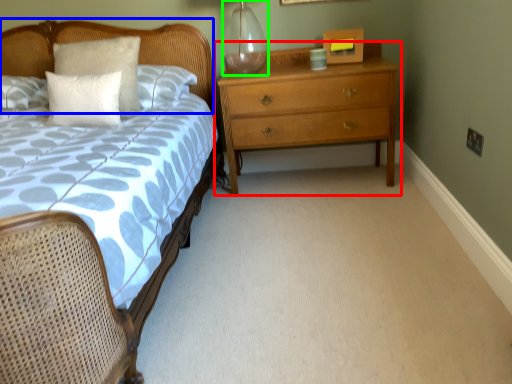
Question: Estimate the real-world distances between objects in this image. Which object is farther from chest of drawers (highlighted by a red box), headboard (highlighted by a blue box) or glass vase (highlighted by a green box)?

Choices:
 (A) headboard
 (B) glass vase

Answer: (A)